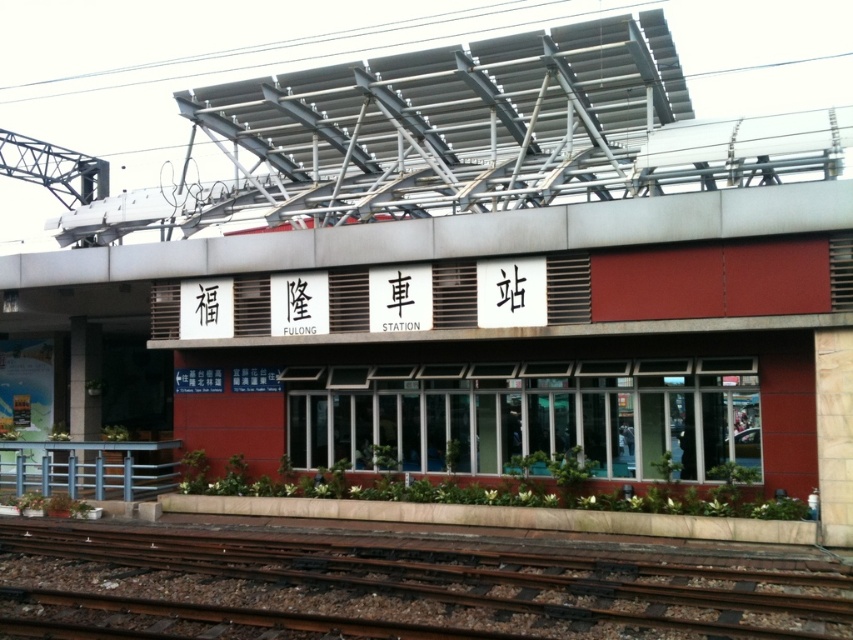
Question: In this image, where is rusty metal train track at bottom located relative to blue painted metal railing at lower left?

Choices:
 (A) left
 (B) right

Answer: (B)

Question: Can you confirm if rusty metal train track at bottom is bigger than blue painted metal railing at lower left?

Choices:
 (A) yes
 (B) no

Answer: (A)

Question: Can you confirm if rusty metal train track at bottom is thinner than blue painted metal railing at lower left?

Choices:
 (A) yes
 (B) no

Answer: (B)

Question: Which point appears farthest from the camera in this image?

Choices:
 (A) (4, 452)
 (B) (302, 536)

Answer: (A)

Question: Among these points, which one is nearest to the camera?

Choices:
 (A) (90, 468)
 (B) (236, 536)

Answer: (B)